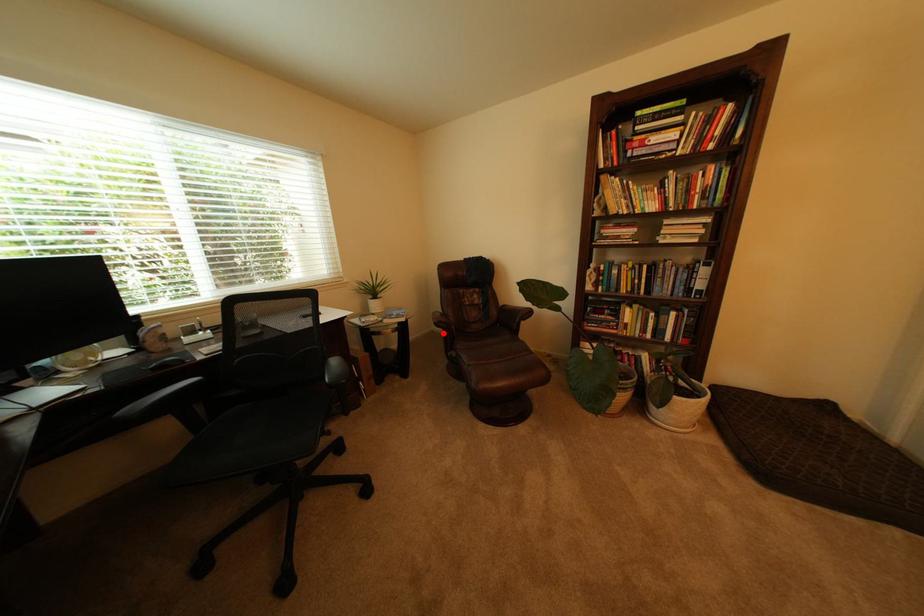
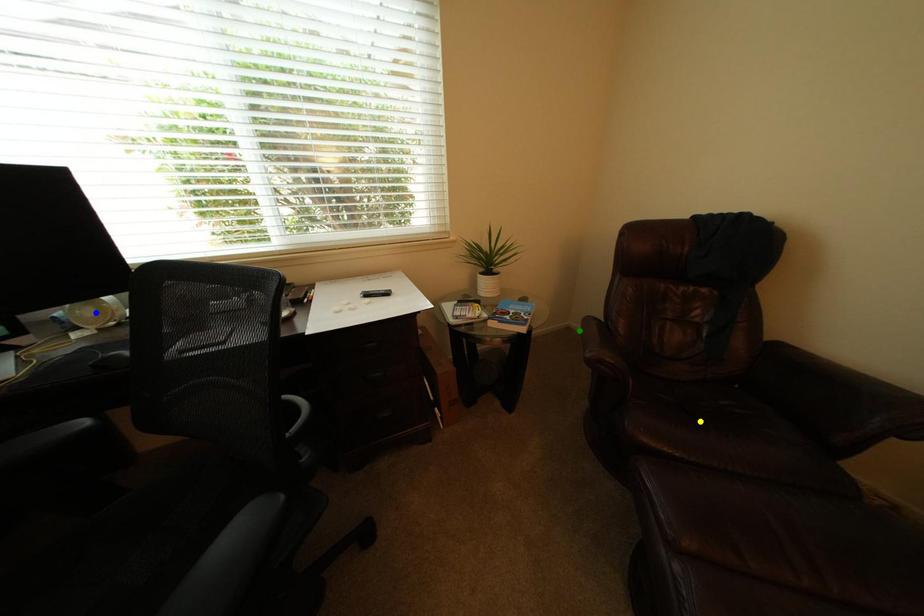
Question: I am providing you with two images of the same scene from different viewpoints. A red point is marked on the first image. You are given multiple points on the second image. Which mark in image 2 goes with the point in image 1?

Choices:
 (A) green point
 (B) blue point
 (C) yellow point

Answer: (A)